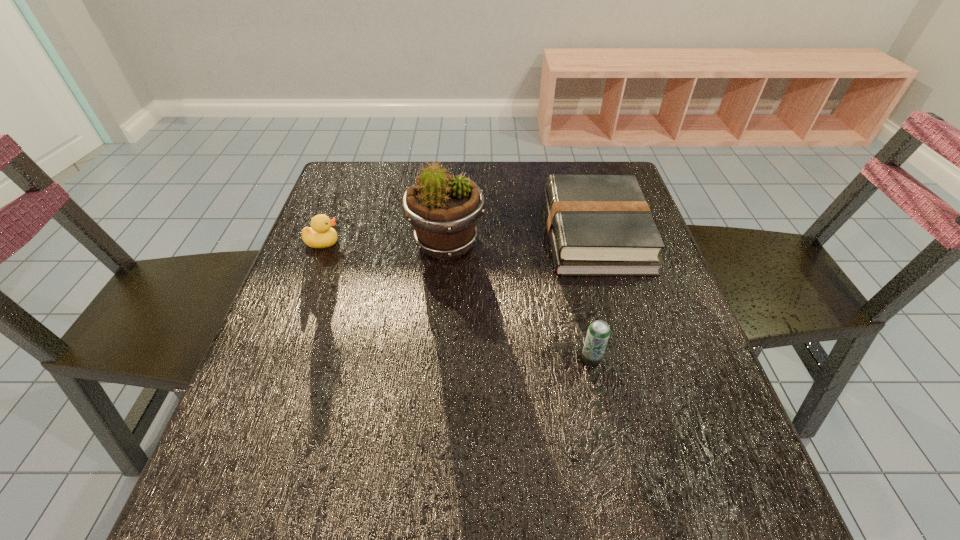
Select which object is the third closest to the leftmost object. Please provide its 2D coordinates. Your answer should be formatted as a tuple, i.e. [(x, y)], where the tuple contains the x and y coordinates of a point satisfying the conditions above.

[(598, 333)]

You are a GUI agent. You are given a task and a screenshot of the screen. Output one action in this format:
    pyautogui.click(x=<x>, y=<y>)
    Task: Click on the closest object to the flowerpot
    
    Given the screenshot: What is the action you would take?
    pyautogui.click(x=599, y=225)

Find the location of a particular element. The image size is (960, 540). vacant point that satisfies the following two spatial constraints: 1. on the face of the duckling; 2. on the back side of the tallest object is located at coordinates (323, 243).

Locate an element on the screen. vacant space that satisfies the following two spatial constraints: 1. on the front side of the nearest object; 2. on the left side of the flowerpot is located at coordinates (437, 358).

Locate an element on the screen. The height and width of the screenshot is (540, 960). free point that satisfies the following two spatial constraints: 1. on the back side of the beer can; 2. on the face of the duckling is located at coordinates (566, 242).

Locate an element on the screen. Image resolution: width=960 pixels, height=540 pixels. vacant space that satisfies the following two spatial constraints: 1. on the face of the leftmost object; 2. on the left side of the nearest object is located at coordinates (278, 358).

Locate an element on the screen. Image resolution: width=960 pixels, height=540 pixels. vacant position in the image that satisfies the following two spatial constraints: 1. on the face of the duckling; 2. on the left side of the flowerpot is located at coordinates (323, 243).

Identify the location of free location that satisfies the following two spatial constraints: 1. on the face of the leftmost object; 2. on the back side of the second object from left to right. Image resolution: width=960 pixels, height=540 pixels. (323, 243).